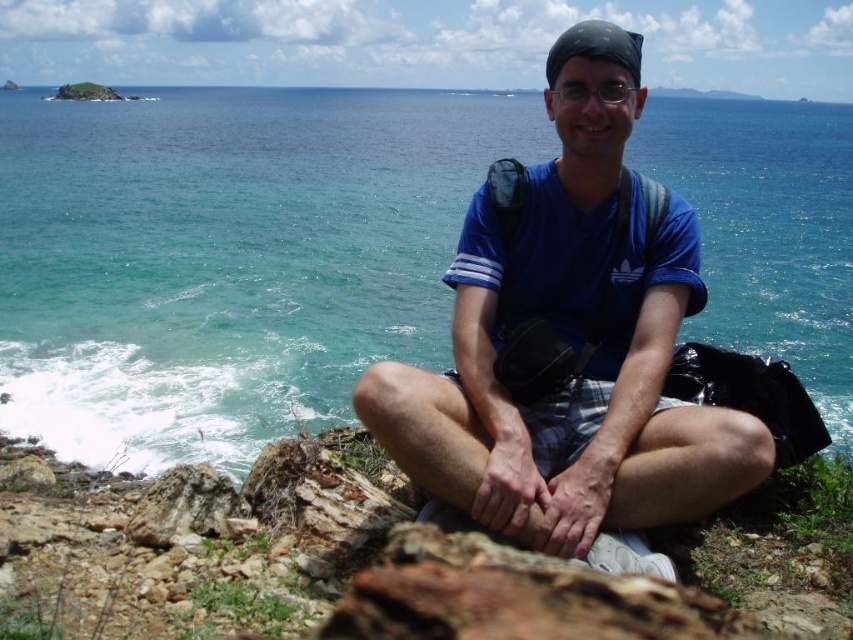
You are a photographer positioned at the camera. You want to capture a photo of the coastal scene. There are two points in the image labeled as point (270, 252) and point (656, 349). Which point is closer to your camera lens?

Point (270, 252) is further to the camera than point (656, 349), so the point closer to the camera lens is point (656, 349).

In the scene shown: You are a photographer planning to take a landscape photo of the coastal scene. You need to ensure that both the blue water at center and the blue cotton shirt at center are visible in the frame. Based on their positions, which object should you prioritize framing first to ensure both are included?

Since the blue water at center might be wider than the blue cotton shirt at center, you should prioritize framing the wider blue water at center first to ensure both fit within the photo.